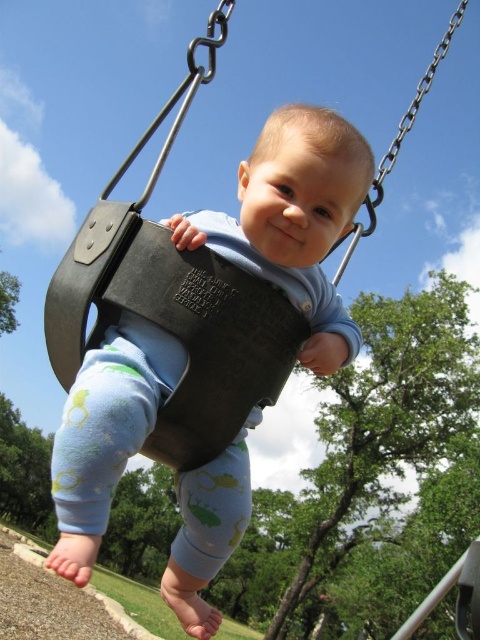
Question: Which point is closer to the camera?

Choices:
 (A) (157, 432)
 (B) (280, 168)

Answer: (B)

Question: Which of the following is the farthest from the observer?

Choices:
 (A) matte black swing at center
 (B) metallic swing seat at center

Answer: (B)

Question: Can you confirm if matte black swing at center is positioned above metallic swing seat at center?

Choices:
 (A) yes
 (B) no

Answer: (B)

Question: Where is matte black swing at center located in relation to metallic swing seat at center in the image?

Choices:
 (A) above
 (B) below

Answer: (B)

Question: Does matte black swing at center have a larger size compared to metallic swing seat at center?

Choices:
 (A) no
 (B) yes

Answer: (A)

Question: Among these objects, which one is nearest to the camera?

Choices:
 (A) matte black swing at center
 (B) metallic swing seat at center

Answer: (A)